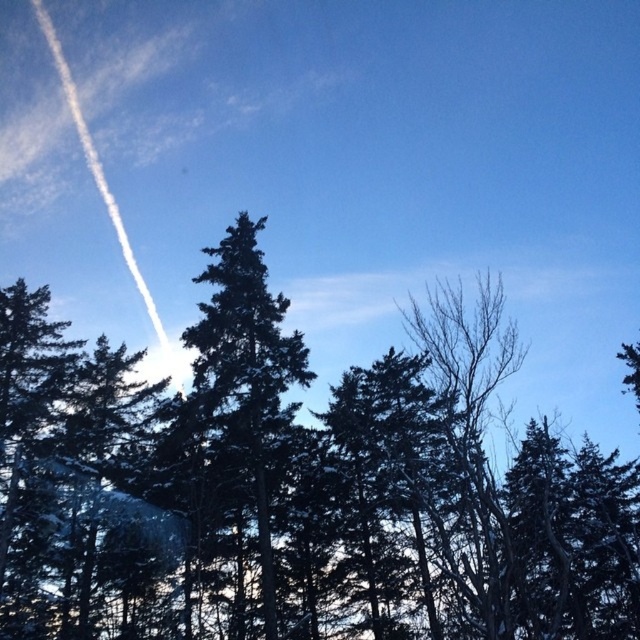
You are an observer looking at the winter scene. There are two points in the image labeled as point 1 at coordinates point 1 at coordinates point (29, 328) and point 2 at coordinates point (250, 440). Which point is closer to you?

Point (29, 328) is closer to the observer because it is further to the viewer than point (250, 440).